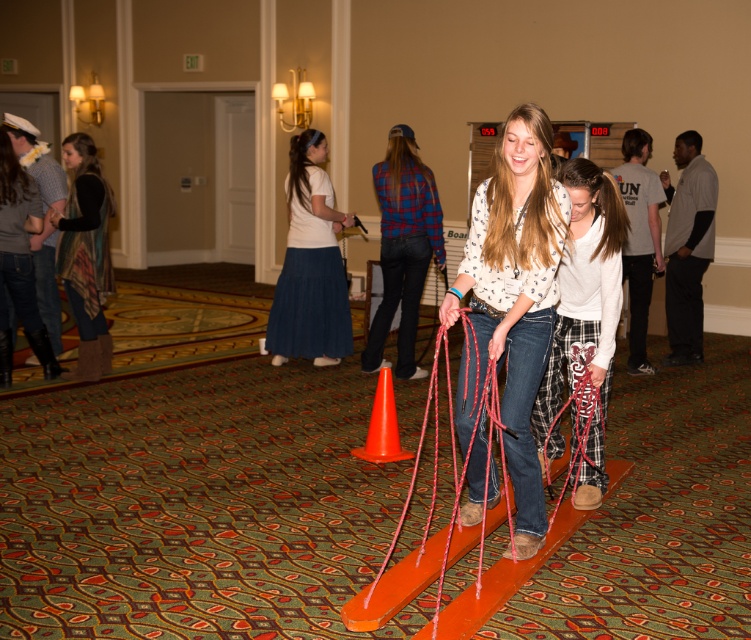
Is point (532, 106) positioned before point (382, 397)?

That is True.

Who is higher up, matte white blouse at center or orange plastic traffic cone at center?

matte white blouse at center

Does point (475, 225) come closer to viewer compared to point (382, 422)?

That is True.

Locate an element on the screen. matte white blouse at center is located at coordinates (510, 310).

Can you confirm if fluffy white sweater at center is positioned above matte gray sweater at left?

Actually, fluffy white sweater at center is below matte gray sweater at left.

What do you see at coordinates (584, 324) in the screenshot? I see `fluffy white sweater at center` at bounding box center [584, 324].

The width and height of the screenshot is (751, 640). Identify the location of fluffy white sweater at center. (584, 324).

Is denim skirt at center smaller than knit scarf at left?

Actually, denim skirt at center might be larger than knit scarf at left.

Locate an element on the screen. denim skirt at center is located at coordinates (309, 264).

The height and width of the screenshot is (640, 751). In order to click on denim skirt at center in this screenshot , I will do `click(309, 264)`.